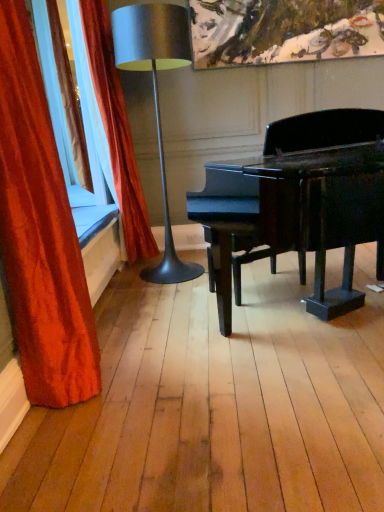
This screenshot has width=384, height=512. I want to click on velvet red curtain at left, the 1th curtain from the back, so click(116, 130).

This screenshot has height=512, width=384. Describe the element at coordinates (40, 233) in the screenshot. I see `velvet red curtain at left, the second curtain viewed from the back` at that location.

Find the location of `metallic silver lamp at left`. metallic silver lamp at left is located at coordinates (156, 97).

Find the location of a particular element. This screenshot has width=384, height=512. velvet red curtain at left, the 1th curtain from the back is located at coordinates (116, 130).

From a real-world perspective, is velvet red curtain at left, the second curtain viewed from the back, physically located above or below metallic silver lamp at left?

In terms of real-world spatial position, velvet red curtain at left, the second curtain viewed from the back, is below metallic silver lamp at left.

Is the depth of velvet red curtain at left, the second curtain viewed from the back, less than that of metallic silver lamp at left?

Yes, velvet red curtain at left, the second curtain viewed from the back, is closer to the viewer.

Is velvet red curtain at left, the second curtain viewed from the back, surrounding metallic silver lamp at left?

No, metallic silver lamp at left is not a part of velvet red curtain at left, the second curtain viewed from the back.

Is velvet red curtain at left, the second curtain viewed from the back, turned away from metallic silver lamp at left?

No, velvet red curtain at left, the second curtain viewed from the back,'s orientation is not away from metallic silver lamp at left.

Considering the sizes of objects metallic silver lamp at left and velvet red curtain at left, the 1th curtain from the back, in the image provided, who is taller, metallic silver lamp at left or velvet red curtain at left, the 1th curtain from the back,?

Standing taller between the two is velvet red curtain at left, the 1th curtain from the back.

Would you say metallic silver lamp at left is inside or outside velvet red curtain at left, the 1th curtain from the back?

metallic silver lamp at left is not enclosed by velvet red curtain at left, the 1th curtain from the back.

From a real-world perspective, who is located lower, metallic silver lamp at left or velvet red curtain at left, the 1th curtain from the back?

In real-world perspective, metallic silver lamp at left is lower.

Could you measure the distance between metallic silver lamp at left and velvet red curtain at left, the 1th curtain from the back?

metallic silver lamp at left is 21.60 inches away from velvet red curtain at left, the 1th curtain from the back.

Does velvet red curtain at left, acting as the second curtain starting from the front, have a lesser height compared to metallic silver lamp at left?

No, velvet red curtain at left, acting as the second curtain starting from the front, is not shorter than metallic silver lamp at left.

Is velvet red curtain at left, the 1th curtain from the back, in front of or behind metallic silver lamp at left in the image?

Clearly, velvet red curtain at left, the 1th curtain from the back, is behind metallic silver lamp at left.

Is velvet red curtain at left, the 1th curtain from the back, positioned far away from metallic silver lamp at left?

No, velvet red curtain at left, the 1th curtain from the back, is in close proximity to metallic silver lamp at left.

Considering their positions, is velvet red curtain at left, acting as the second curtain starting from the front, located in front of or behind velvet red curtain at left, the second curtain viewed from the back?

In the image, velvet red curtain at left, acting as the second curtain starting from the front, appears behind velvet red curtain at left, the second curtain viewed from the back.

From the image's perspective, between velvet red curtain at left, acting as the second curtain starting from the front, and velvet red curtain at left, the second curtain viewed from the back, which one is located above?

From the image's view, velvet red curtain at left, acting as the second curtain starting from the front, is above.

Which of these two, velvet red curtain at left, the 1th curtain from the back, or velvet red curtain at left, the second curtain viewed from the back, stands shorter?

Standing shorter between the two is velvet red curtain at left, the second curtain viewed from the back.

From a real-world perspective, which is physically above, velvet red curtain at left, acting as the second curtain starting from the front, or velvet red curtain at left, acting as the first curtain starting from the front?

velvet red curtain at left, acting as the second curtain starting from the front, is physically above.

Does point (28, 170) lie behind point (91, 2)?

No.

This screenshot has width=384, height=512. I want to click on curtain above the velvet red curtain at left, the second curtain viewed from the back (from the image's perspective), so click(x=116, y=130).

Do you think velvet red curtain at left, acting as the first curtain starting from the front, is within velvet red curtain at left, acting as the second curtain starting from the front, or outside of it?

velvet red curtain at left, acting as the first curtain starting from the front, lies outside velvet red curtain at left, acting as the second curtain starting from the front.

Which object is further away from the camera, velvet red curtain at left, acting as the first curtain starting from the front, or velvet red curtain at left, the 1th curtain from the back?

velvet red curtain at left, the 1th curtain from the back.

Is metallic silver lamp at left inside or outside of velvet red curtain at left, the second curtain viewed from the back?

metallic silver lamp at left is not inside velvet red curtain at left, the second curtain viewed from the back, it's outside.

Which is in front, point (153, 50) or point (11, 192)?

The point (11, 192) is in front.

Based on their positions, is metallic silver lamp at left located to the left or right of velvet red curtain at left, acting as the first curtain starting from the front?

From the image, it's evident that metallic silver lamp at left is to the right of velvet red curtain at left, acting as the first curtain starting from the front.

Considering the sizes of objects metallic silver lamp at left and velvet red curtain at left, acting as the first curtain starting from the front, in the image provided, who is bigger, metallic silver lamp at left or velvet red curtain at left, acting as the first curtain starting from the front,?

With larger size is metallic silver lamp at left.

The width and height of the screenshot is (384, 512). In the image, there is a metallic silver lamp at left. What are the coordinates of `curtain below it (from a real-world perspective)` in the screenshot? It's located at (40, 233).

Identify the location of curtain above the metallic silver lamp at left (from a real-world perspective). (116, 130).

Considering their positions, is metallic silver lamp at left positioned further to velvet red curtain at left, the second curtain viewed from the back, than velvet red curtain at left, the 1th curtain from the back?

velvet red curtain at left, the 1th curtain from the back.

Which object lies nearer to the anchor point velvet red curtain at left, acting as the first curtain starting from the front, velvet red curtain at left, the 1th curtain from the back, or metallic silver lamp at left?

The object closer to velvet red curtain at left, acting as the first curtain starting from the front, is metallic silver lamp at left.

Which object lies nearer to the anchor point metallic silver lamp at left, velvet red curtain at left, the second curtain viewed from the back, or velvet red curtain at left, the 1th curtain from the back?

velvet red curtain at left, the 1th curtain from the back, lies closer to metallic silver lamp at left than the other object.

Which object lies further to the anchor point velvet red curtain at left, acting as the second curtain starting from the front, velvet red curtain at left, the second curtain viewed from the back, or metallic silver lamp at left?

velvet red curtain at left, the second curtain viewed from the back, lies further to velvet red curtain at left, acting as the second curtain starting from the front, than the other object.

Based on their spatial positions, is velvet red curtain at left, acting as the second curtain starting from the front, or velvet red curtain at left, acting as the first curtain starting from the front, closer to metallic silver lamp at left?

velvet red curtain at left, acting as the second curtain starting from the front.

Based on their spatial positions, is metallic silver lamp at left or velvet red curtain at left, acting as the first curtain starting from the front, further from velvet red curtain at left, acting as the second curtain starting from the front?

Among the two, velvet red curtain at left, acting as the first curtain starting from the front, is located further to velvet red curtain at left, acting as the second curtain starting from the front.

Find the location of a particular element. This screenshot has height=512, width=384. lamp between velvet red curtain at left, acting as the first curtain starting from the front, and velvet red curtain at left, the 1th curtain from the back, from front to back is located at coordinates (156, 97).